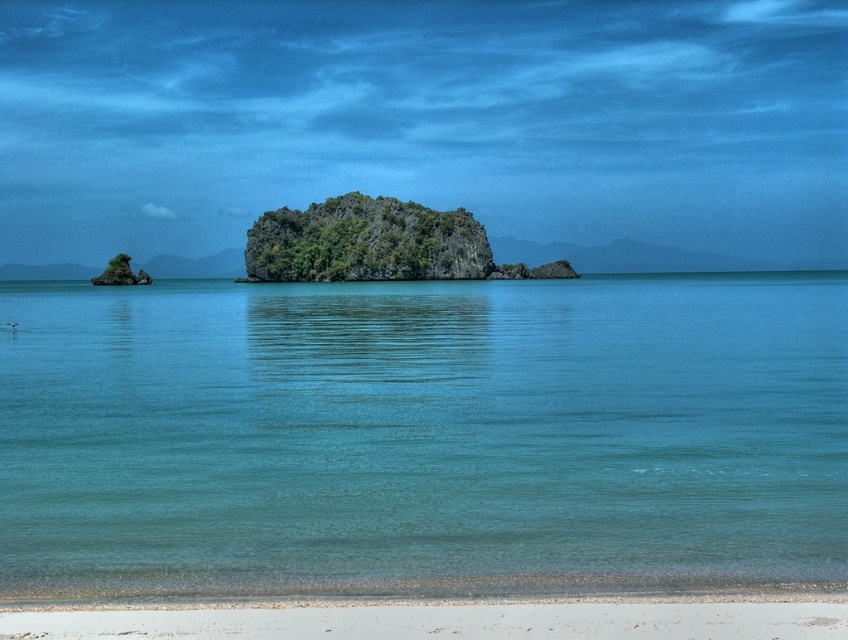
Which is more to the right, clear blue water at lower center or white sandy beach at lower center?

white sandy beach at lower center

Can you confirm if clear blue water at lower center is positioned above white sandy beach at lower center?

Indeed, clear blue water at lower center is positioned over white sandy beach at lower center.

Between point (752, 292) and point (82, 625), which one is positioned in front?

Positioned in front is point (82, 625).

This screenshot has height=640, width=848. Find the location of `clear blue water at lower center`. clear blue water at lower center is located at coordinates (422, 435).